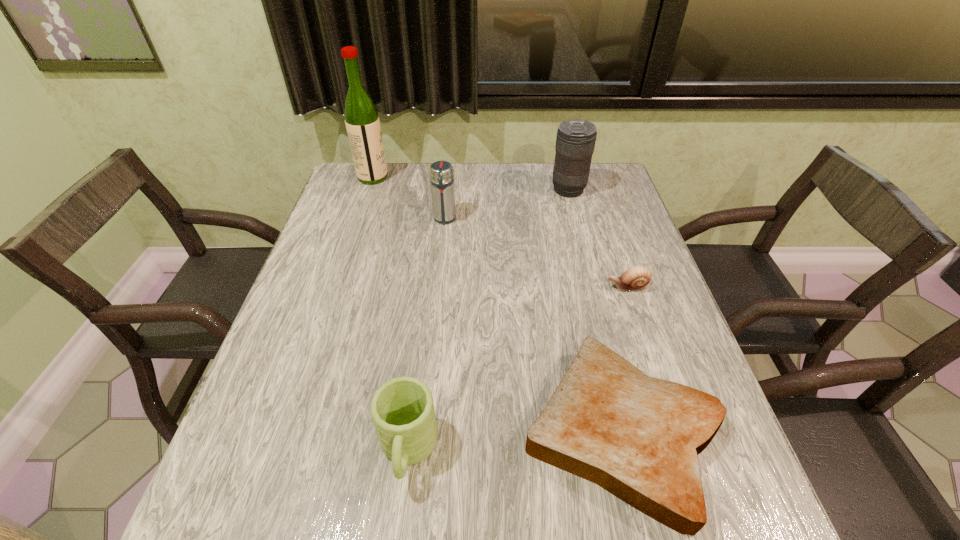
The image size is (960, 540). In order to click on vacant region located 0.140m on the side of the telephoto lens where the control switches are located in this screenshot , I will do `click(506, 190)`.

This screenshot has height=540, width=960. In order to click on vacant space located 0.070m on the side of the telephoto lens where the control switches are located in this screenshot , I will do `click(528, 190)`.

At what (x,y) coordinates should I click in order to perform the action: click on vacant area situated with a handle on the side of the third tallest object. Please return your answer as a coordinate pair (x, y). Looking at the image, I should click on (440, 266).

Image resolution: width=960 pixels, height=540 pixels. In order to click on vacant space located 0.070m on the front-facing side of the third nearest object in this screenshot , I will do `click(576, 287)`.

The image size is (960, 540). What are the coordinates of `free space located on the front-facing side of the third nearest object` in the screenshot? It's located at (536, 287).

In order to click on vacant position located on the front-facing side of the third nearest object in this screenshot , I will do `click(511, 287)`.

Where is `vacant space located on the left of the bread`? vacant space located on the left of the bread is located at coordinates (320, 431).

At what (x,y) coordinates should I click in order to perform the action: click on liquor located at the far edge. Please return your answer as a coordinate pair (x, y). The width and height of the screenshot is (960, 540). Looking at the image, I should click on (362, 122).

Where is `telephoto lens located at the far edge`? telephoto lens located at the far edge is located at coordinates (575, 141).

The height and width of the screenshot is (540, 960). What are the coordinates of `object that is at the near edge` in the screenshot? It's located at (638, 437).